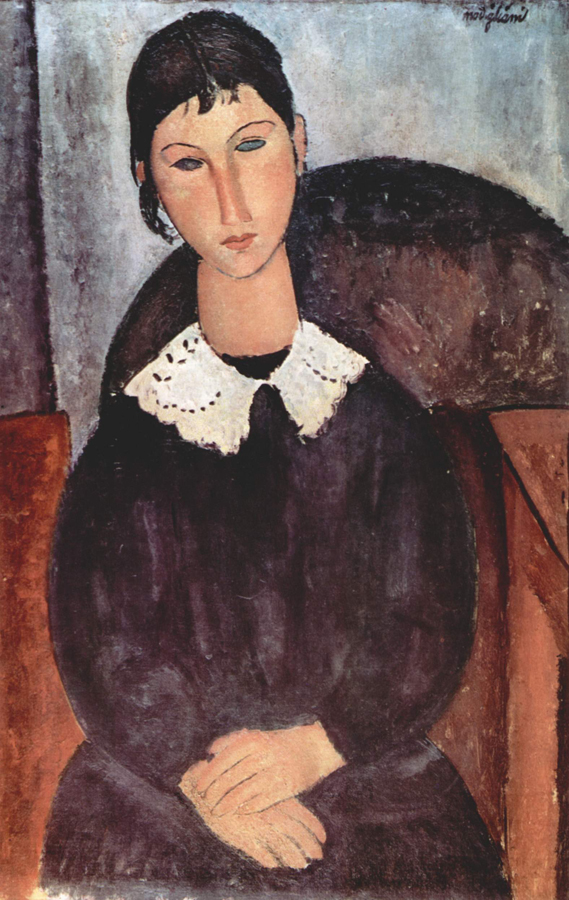
Locate an element on the screen. The width and height of the screenshot is (569, 900). table is located at coordinates (555, 472).